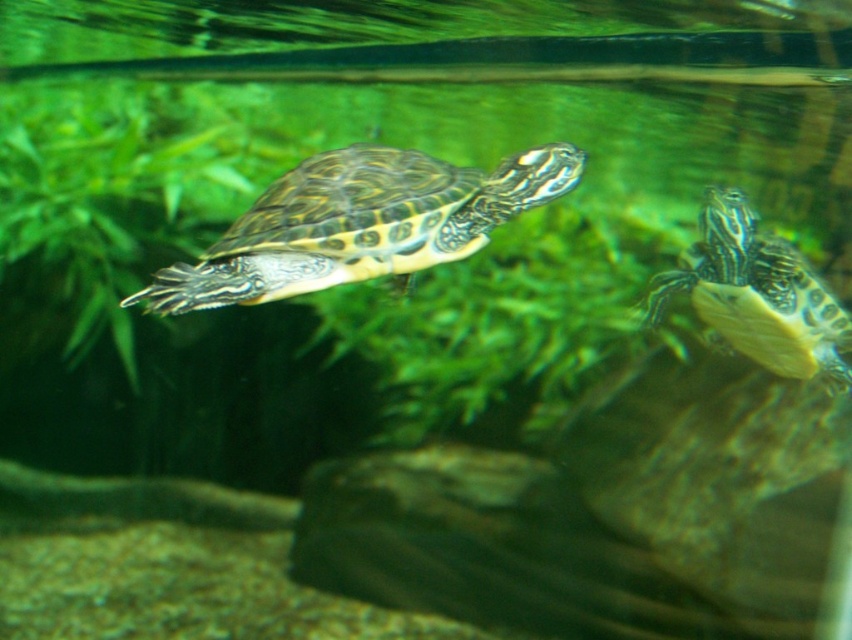
Question: Can you confirm if patterned shell turtle at center is positioned below patterned shell turtle at right?

Choices:
 (A) yes
 (B) no

Answer: (B)

Question: Can you confirm if patterned shell turtle at center is smaller than patterned shell turtle at right?

Choices:
 (A) no
 (B) yes

Answer: (B)

Question: Is patterned shell turtle at center to the right of patterned shell turtle at right from the viewer's perspective?

Choices:
 (A) yes
 (B) no

Answer: (B)